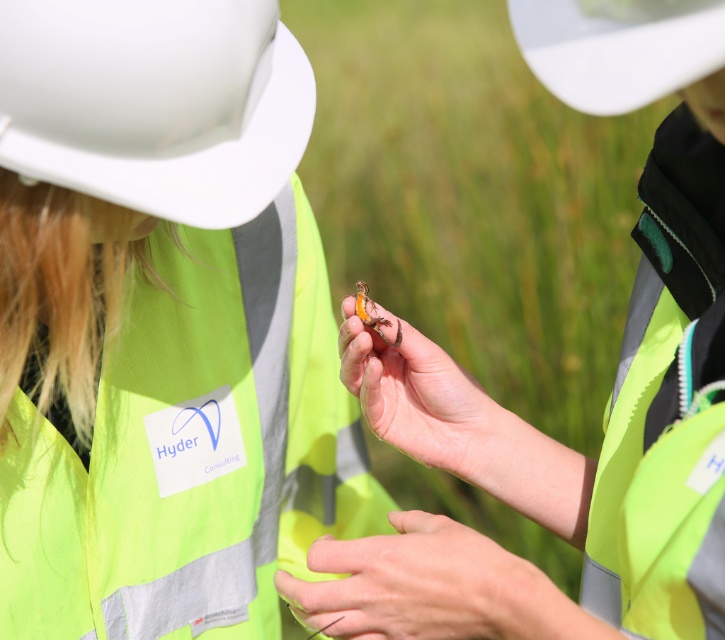
Is point (378, 579) behind point (368, 324)?

No, (378, 579) is closer to viewer.

In the scene shown: Which is above, smooth yellow-green vest at lower center or translucent orange insect at center?

translucent orange insect at center

Identify the location of smooth yellow-green vest at lower center. The image size is (725, 640). (423, 586).

Where is `smooth yellow-green vest at lower center`? Image resolution: width=725 pixels, height=640 pixels. smooth yellow-green vest at lower center is located at coordinates click(x=423, y=586).

Does white matte hard hat at upper left lie in front of white matte hard hat at upper center?

No, it is behind white matte hard hat at upper center.

Describe the element at coordinates (154, 104) in the screenshot. I see `white matte hard hat at upper left` at that location.

Does point (174, 208) lie behind point (618, 72)?

Yes, point (174, 208) is farther from viewer.

At what (x,y) coordinates should I click in order to perform the action: click on white matte hard hat at upper left. Please return your answer as a coordinate pair (x, y). The width and height of the screenshot is (725, 640). Looking at the image, I should click on (154, 104).

Does orange matte rock at center have a larger size compared to white matte hard hat at upper left?

Yes, orange matte rock at center is bigger than white matte hard hat at upper left.

Can you confirm if orange matte rock at center is shorter than white matte hard hat at upper left?

No, orange matte rock at center is not shorter than white matte hard hat at upper left.

Does point (621, 573) lie behind point (117, 138)?

Yes, point (621, 573) is farther from viewer.

The height and width of the screenshot is (640, 725). Identify the location of orange matte rock at center. (608, 403).